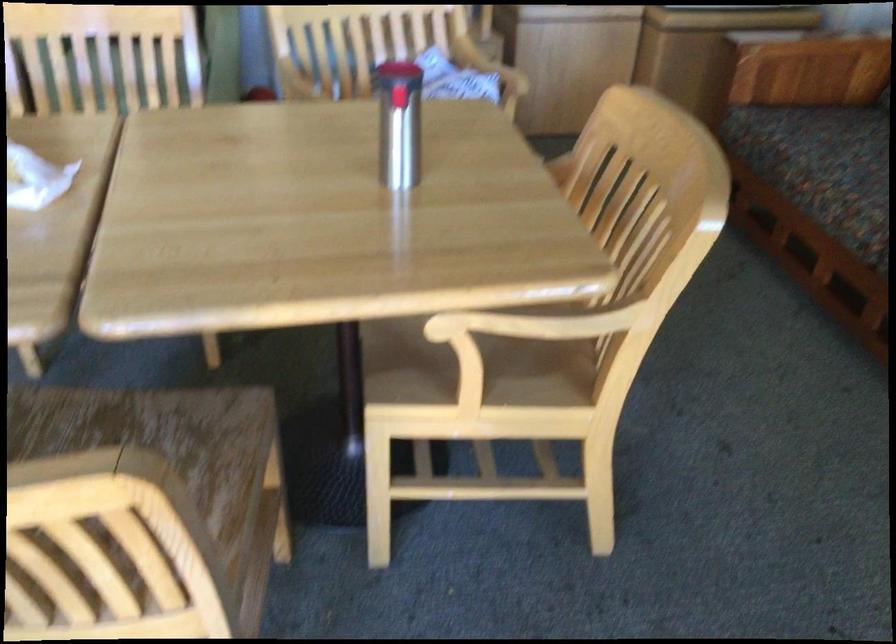
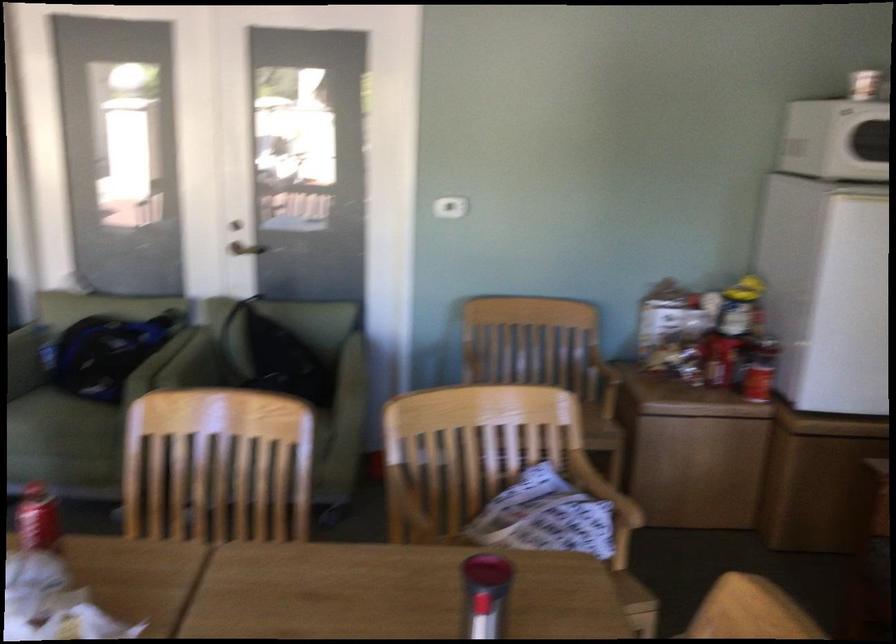
Question: The images are taken continuously from a first-person perspective. In which direction is your viewpoint rotating?

Choices:
 (A) Left
 (B) Right
 (C) Up
 (D) Down

Answer: (C)